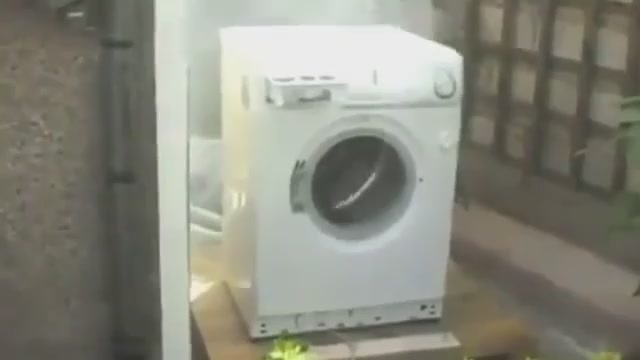
Image resolution: width=640 pixels, height=360 pixels. What are the coordinates of `handle` in the screenshot? It's located at (125, 40).